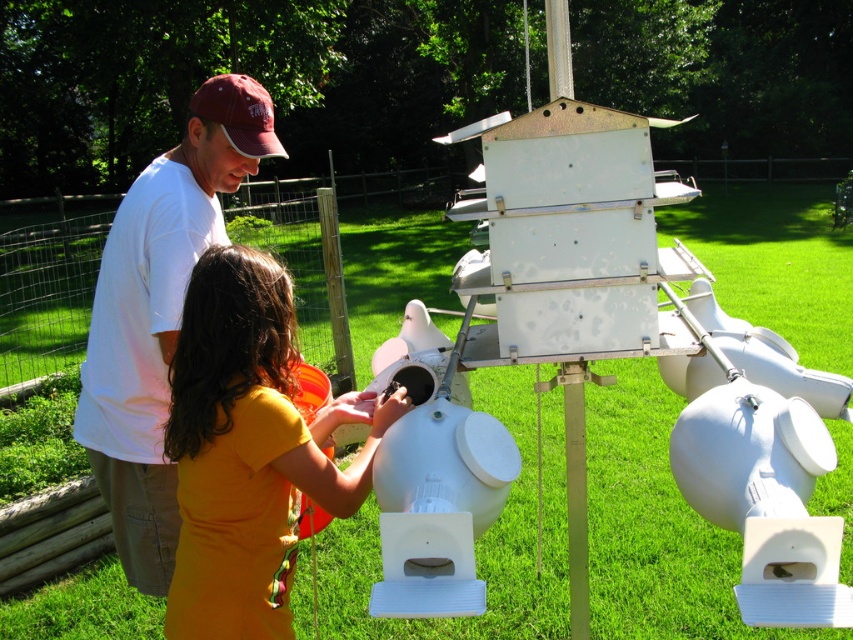
Does yellow matte shirt at center have a greater width compared to white matte shirt at upper left?

In fact, yellow matte shirt at center might be narrower than white matte shirt at upper left.

Is yellow matte shirt at center above white matte shirt at upper left?

No, yellow matte shirt at center is not above white matte shirt at upper left.

Which is in front, point (366, 394) or point (123, 468)?

Point (366, 394) is in front.

At what (x,y) coordinates should I click in order to perform the action: click on yellow matte shirt at center. Please return your answer as a coordinate pair (x, y). The width and height of the screenshot is (853, 640). Looking at the image, I should click on (248, 449).